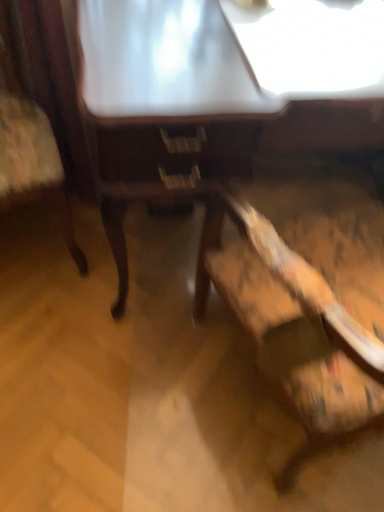
You are a GUI agent. You are given a task and a screenshot of the screen. Output one action in this format:
    pyautogui.click(x=<x>, y=<y>)
    Task: Click on the vacant space in front of wooden chair at left, the first chair positioned from the left
    
    Given the screenshot: What is the action you would take?
    pyautogui.click(x=51, y=331)